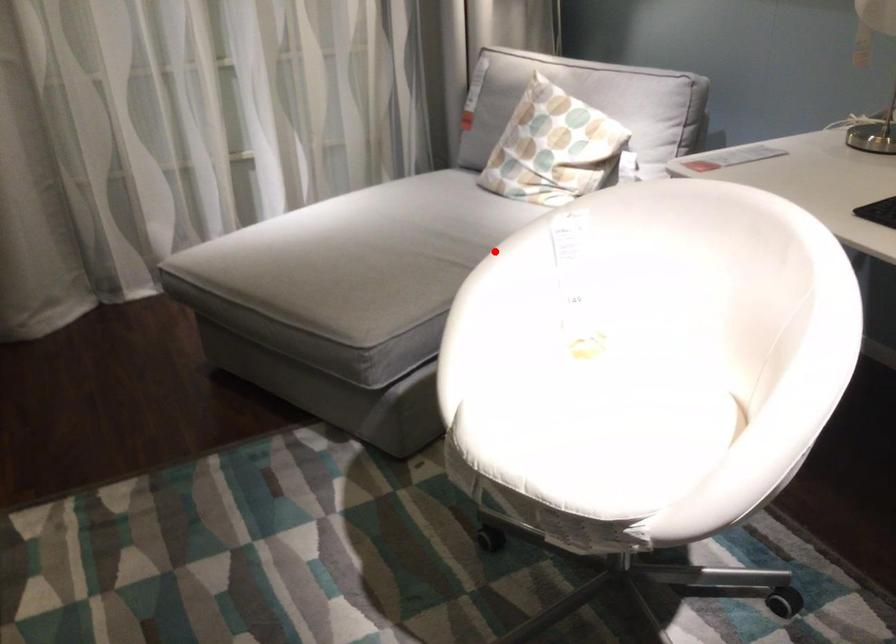
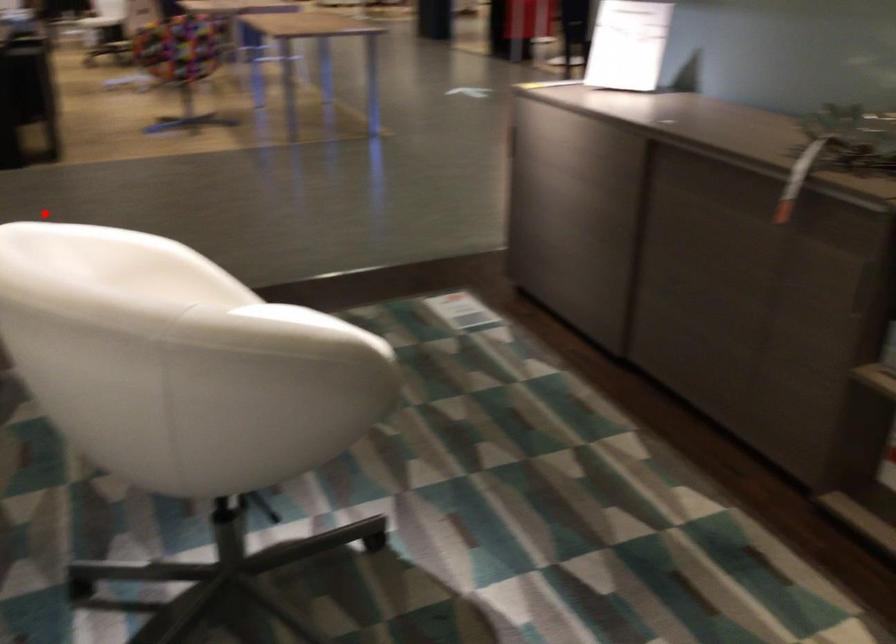
I am providing you with two images of the same scene from different viewpoints. A red point is marked on the first image and another point is marked on the second image. Do the highlighted points in image1 and image2 indicate the same real-world spot?

No